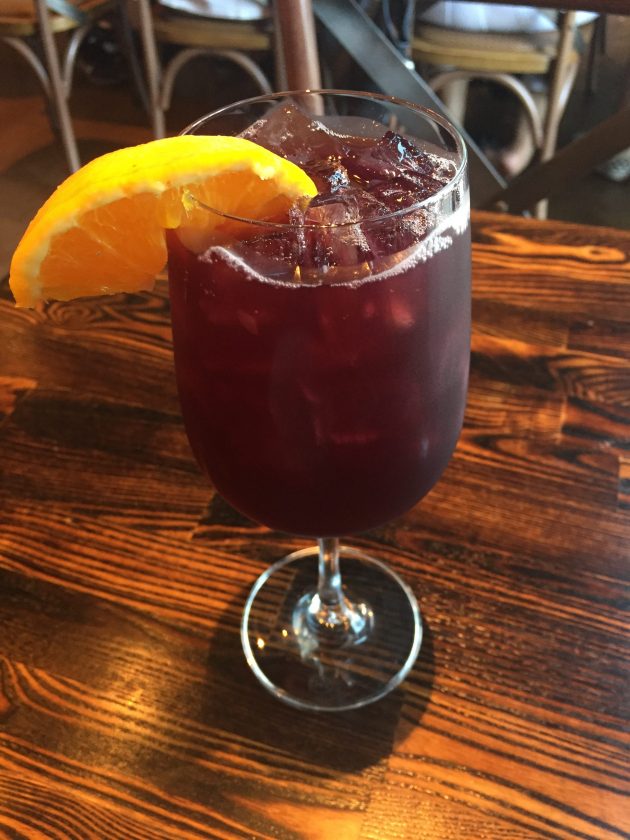
This screenshot has width=630, height=840. What are the coordinates of `wood table` in the screenshot? It's located at (581, 462).